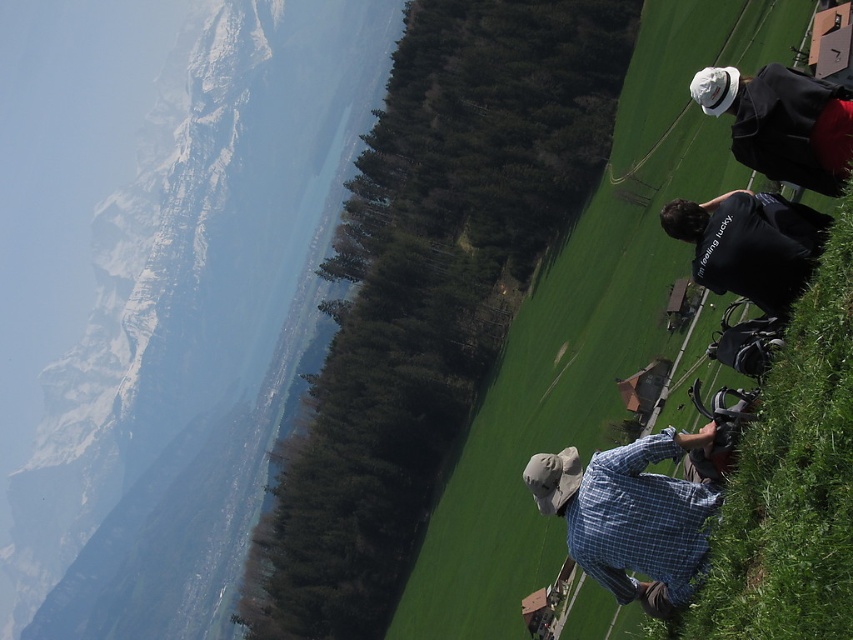
Can you confirm if white matte hat at upper right is positioned above black cotton shirt at center right?

Yes.

Identify the location of white matte hat at upper right. The width and height of the screenshot is (853, 640). (782, 122).

Which is in front, point (801, 83) or point (720, 278)?

Point (801, 83) is in front.

This screenshot has width=853, height=640. I want to click on white matte hat at upper right, so click(x=782, y=122).

Does green grass at right appear on the right side of white matte hat at upper right?

Correct, you'll find green grass at right to the right of white matte hat at upper right.

Does green grass at right appear under white matte hat at upper right?

Yes.

The height and width of the screenshot is (640, 853). In order to click on green grass at right in this screenshot , I will do `click(558, 392)`.

Is point (663, 589) farther from viewer compared to point (715, 92)?

No, it is not.

Which is below, blue plaid shirt at lower right or white matte hat at upper right?

blue plaid shirt at lower right is below.

Is point (558, 460) less distant than point (822, 102)?

That is False.

You are a GUI agent. You are given a task and a screenshot of the screen. Output one action in this format:
    pyautogui.click(x=<x>, y=<y>)
    Task: Click on the blue plaid shirt at lower right
    
    Given the screenshot: What is the action you would take?
    pyautogui.click(x=631, y=515)